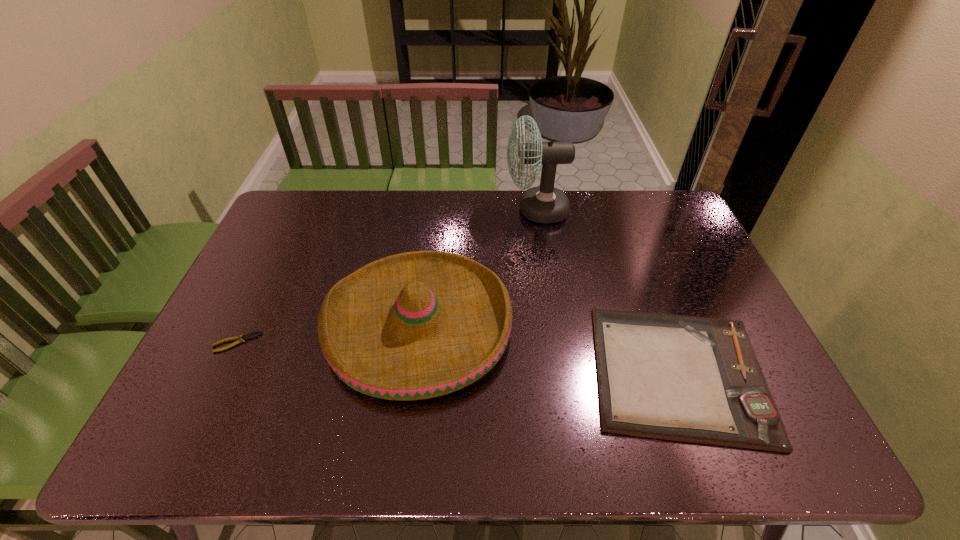
Image resolution: width=960 pixels, height=540 pixels. Identify the location of the farthest object. (546, 204).

Locate an element on the screen. Image resolution: width=960 pixels, height=540 pixels. the tallest object is located at coordinates (546, 204).

The image size is (960, 540). Identify the location of sombrero. (417, 325).

What are the coordinates of `the third shortest object` in the screenshot? It's located at (417, 325).

This screenshot has width=960, height=540. In order to click on the third tallest object in this screenshot , I will do click(x=694, y=379).

This screenshot has height=540, width=960. Identify the location of the leftmost object. (241, 338).

Where is `the shortest object`? This screenshot has width=960, height=540. the shortest object is located at coordinates (241, 338).

Locate an element on the screen. The image size is (960, 540). free space located in front of the tallest object where the airflow is directed is located at coordinates (460, 210).

Where is `vacant space located 0.380m in front of the tallest object where the airflow is directed`? The height and width of the screenshot is (540, 960). vacant space located 0.380m in front of the tallest object where the airflow is directed is located at coordinates (398, 210).

At what (x,y) coordinates should I click in order to perform the action: click on free region located 0.160m in front of the tallest object where the airflow is directed. Please return your answer as a coordinate pair (x, y). The image size is (960, 540). Looking at the image, I should click on pos(460,210).